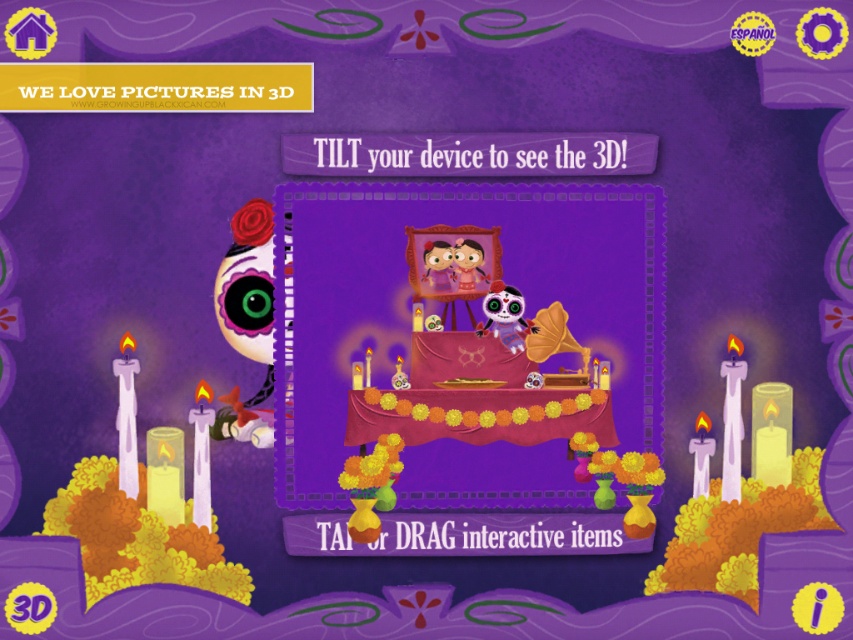
Is matte pink tablecloth at center positioned at the back of matte plastic skull at center?

That is False.

Who is positioned more to the right, matte pink tablecloth at center or matte plastic skull at center?

Positioned to the right is matte plastic skull at center.

Find the location of a particular element. The width and height of the screenshot is (853, 640). matte pink tablecloth at center is located at coordinates (468, 365).